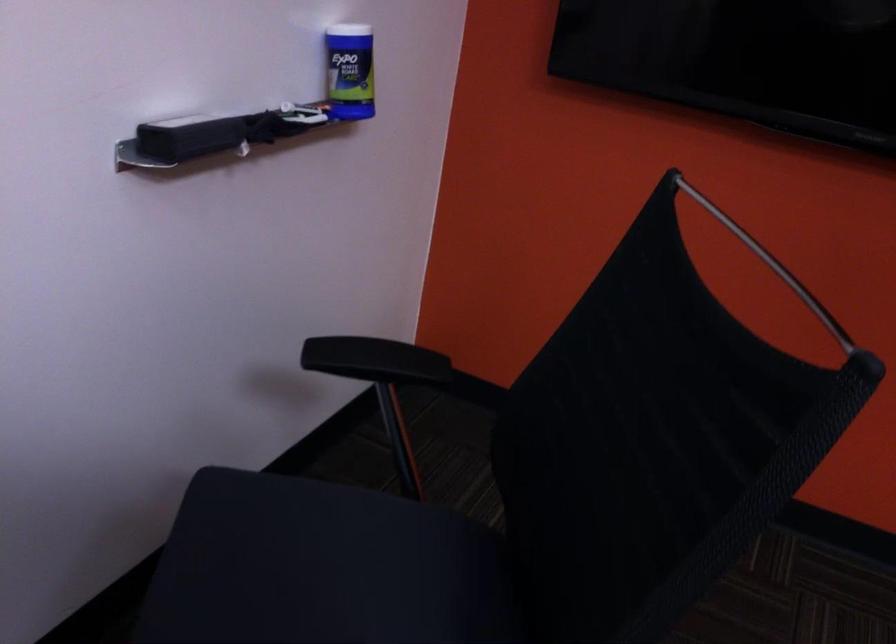
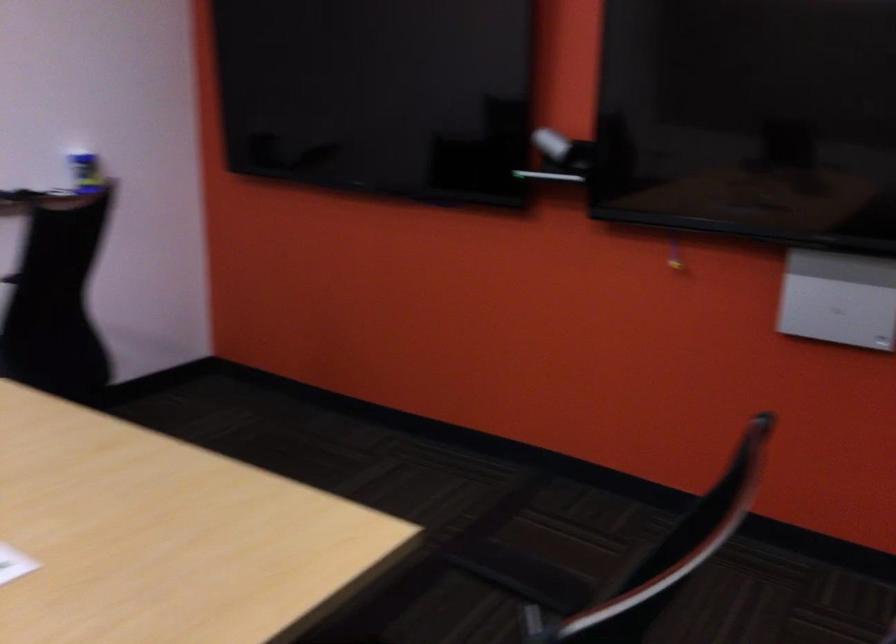
Which direction would the cameraman need to move to produce the second image?

The cameraman moved toward right, backward.